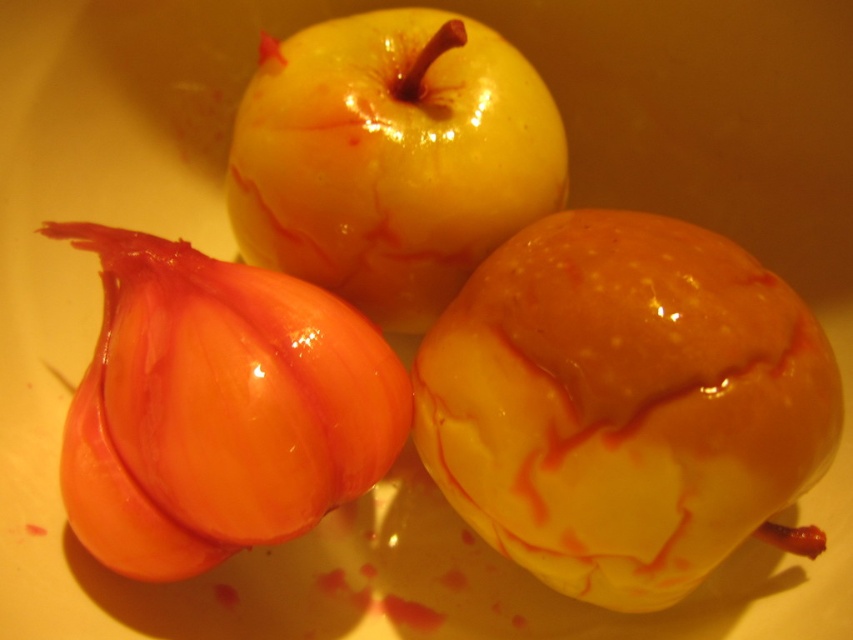
Question: Is shiny orange onion at lower left smaller than yellow shiny apple at center?

Choices:
 (A) yes
 (B) no

Answer: (A)

Question: Among these objects, which one is nearest to the camera?

Choices:
 (A) shiny orange onion at lower left
 (B) yellow shiny apple at center

Answer: (A)

Question: Does shiny orange onion at lower left appear over yellow shiny apple at center?

Choices:
 (A) yes
 (B) no

Answer: (B)

Question: Does shiny orange onion at lower left have a greater width compared to yellow shiny apple at center?

Choices:
 (A) no
 (B) yes

Answer: (A)